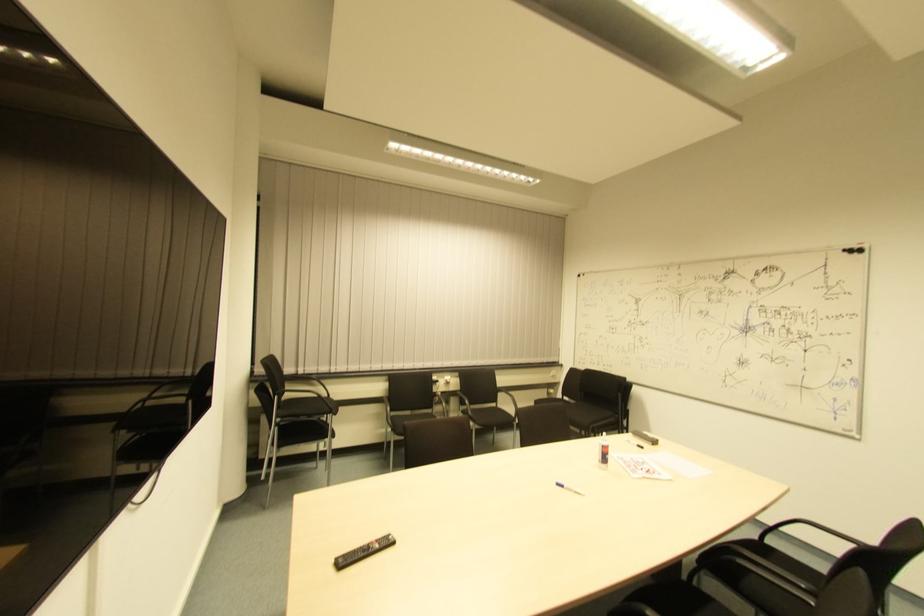
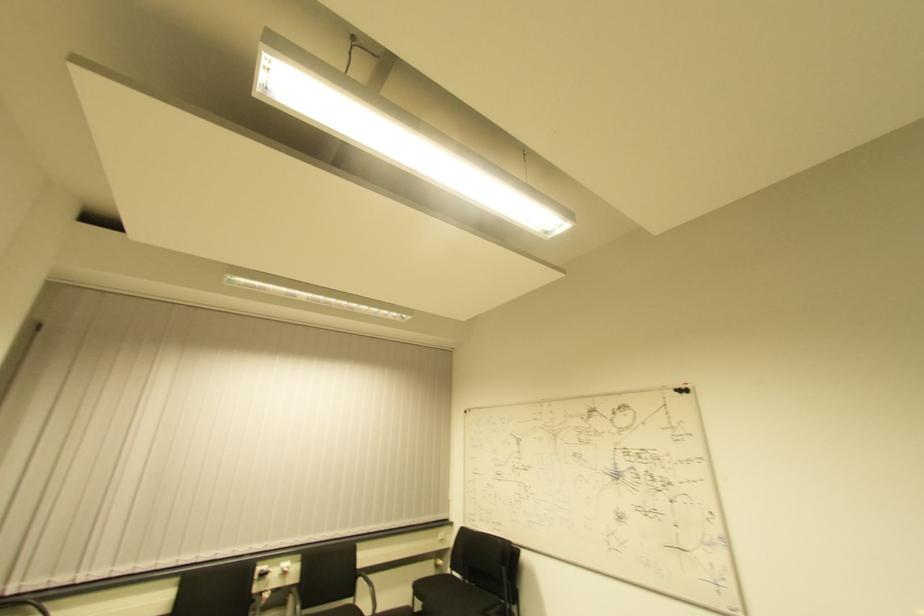
Question: How did the camera likely rotate?

Choices:
 (A) Left
 (B) Right
 (C) Up
 (D) Down

Answer: (C)